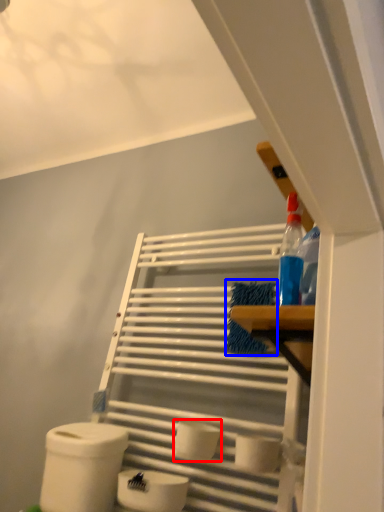
Question: Among these objects, which one is farthest to the camera, toilet paper (highlighted by a red box) or material (highlighted by a blue box)?

Choices:
 (A) toilet paper
 (B) material

Answer: (B)